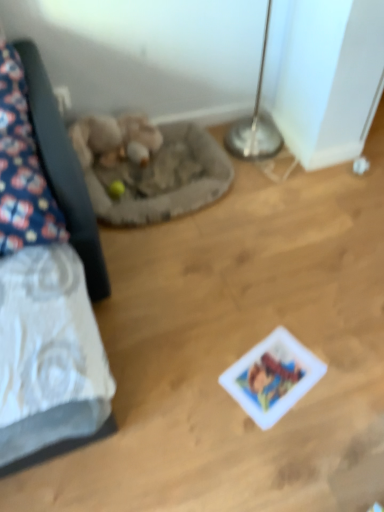
The width and height of the screenshot is (384, 512). I want to click on vacant space to the right of white glossy card at center, so click(344, 376).